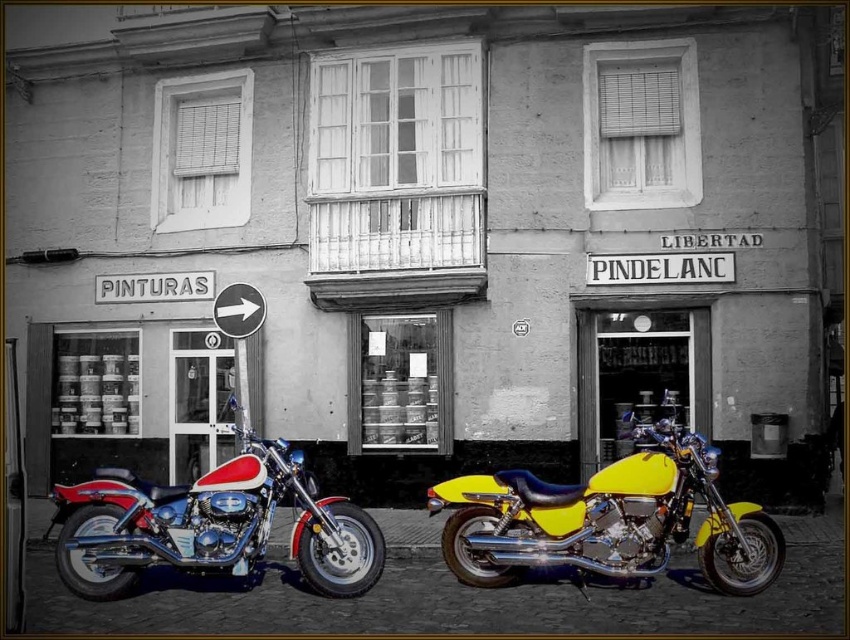
Who is more distant from viewer, (486, 564) or (350, 541)?

The point (486, 564) is behind.

Consider the image. Which is below, yellow shiny motorcycle at center or shiny chrome motorcycle at center?

shiny chrome motorcycle at center

Which is in front, point (749, 522) or point (218, 564)?

Point (218, 564) is more forward.

You are a GUI agent. You are given a task and a screenshot of the screen. Output one action in this format:
    pyautogui.click(x=<x>, y=<y>)
    Task: Click on the yellow shiny motorcycle at center
    This screenshot has width=850, height=640.
    Given the screenshot: What is the action you would take?
    pyautogui.click(x=609, y=518)